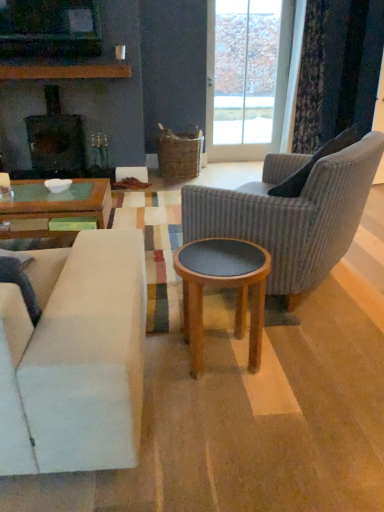
This screenshot has width=384, height=512. I want to click on free location above wooden round stool at center (from a real-world perspective), so click(x=220, y=262).